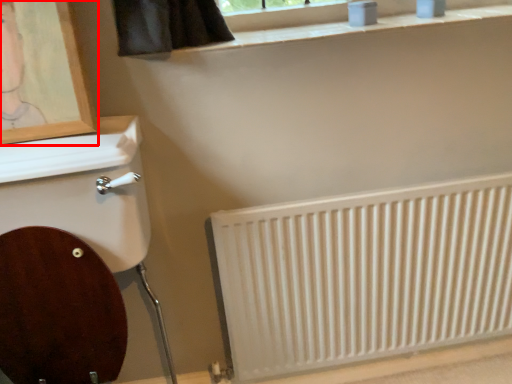
Question: In this image, where is picture frame (annotated by the red box) located relative to radiator?

Choices:
 (A) left
 (B) right

Answer: (A)